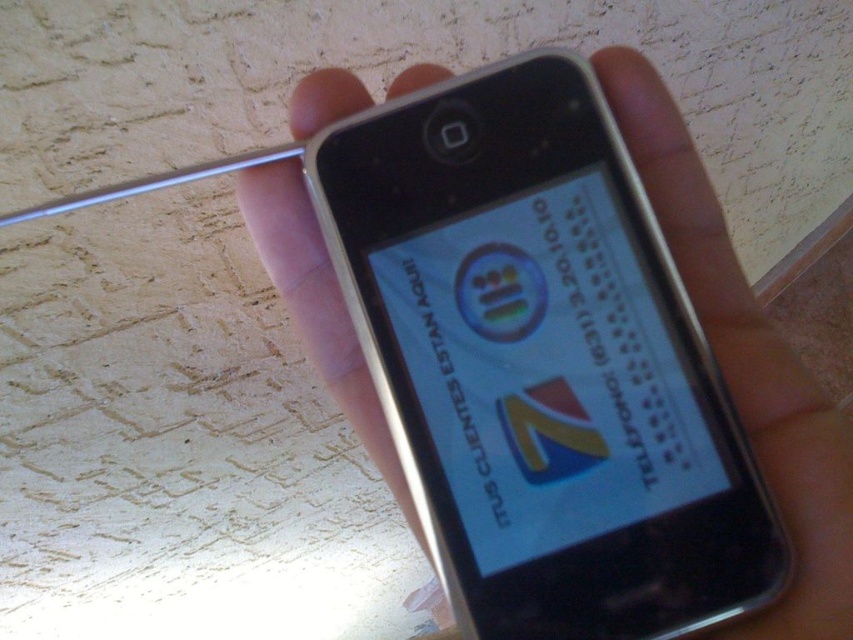
Who is shorter, silver metallic phone at center or white glossy logo at center?

white glossy logo at center is shorter.

Between silver metallic phone at center and white glossy logo at center, which one has more height?

silver metallic phone at center is taller.

Between point (270, 170) and point (437, 340), which one is positioned behind?

Positioned behind is point (270, 170).

At what (x,y) coordinates should I click in order to perform the action: click on silver metallic phone at center. Please return your answer as a coordinate pair (x, y). This screenshot has width=853, height=640. Looking at the image, I should click on (747, 362).

Can you confirm if white glossy text at center is wider than white glossy logo at center?

Yes, white glossy text at center is wider than white glossy logo at center.

Can you confirm if white glossy text at center is bigger than white glossy logo at center?

Indeed, white glossy text at center has a larger size compared to white glossy logo at center.

Who is more distant from viewer, (566, 310) or (477, 460)?

The point (566, 310) is behind.

Locate an element on the screen. The width and height of the screenshot is (853, 640). white glossy text at center is located at coordinates (602, 353).

Does silver metallic phone at center have a lesser height compared to white glossy text at center?

In fact, silver metallic phone at center may be taller than white glossy text at center.

Based on the photo, measure the distance from silver metallic phone at center to white glossy text at center.

silver metallic phone at center is 7.56 centimeters from white glossy text at center.

What are the coordinates of `silver metallic phone at center` in the screenshot? It's located at (747, 362).

Where is `silver metallic phone at center`? This screenshot has height=640, width=853. silver metallic phone at center is located at coordinates (747, 362).